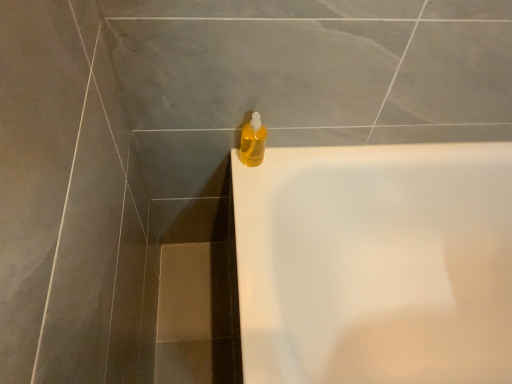
Question: Would you say white glossy bathtub at upper right contains translucent yellow liquid at upper right?

Choices:
 (A) yes
 (B) no

Answer: (B)

Question: Are white glossy bathtub at upper right and translucent yellow liquid at upper right located far from each other?

Choices:
 (A) yes
 (B) no

Answer: (B)

Question: Considering the relative sizes of white glossy bathtub at upper right and translucent yellow liquid at upper right in the image provided, is white glossy bathtub at upper right thinner than translucent yellow liquid at upper right?

Choices:
 (A) no
 (B) yes

Answer: (A)

Question: From a real-world perspective, is white glossy bathtub at upper right on translucent yellow liquid at upper right?

Choices:
 (A) no
 (B) yes

Answer: (A)

Question: Is white glossy bathtub at upper right turned away from translucent yellow liquid at upper right?

Choices:
 (A) yes
 (B) no

Answer: (B)

Question: Considering the relative sizes of white glossy bathtub at upper right and translucent yellow liquid at upper right in the image provided, is white glossy bathtub at upper right taller than translucent yellow liquid at upper right?

Choices:
 (A) yes
 (B) no

Answer: (A)

Question: Is translucent yellow liquid at upper right turned away from white glossy bathtub at upper right?

Choices:
 (A) yes
 (B) no

Answer: (B)

Question: From a real-world perspective, is translucent yellow liquid at upper right located beneath white glossy bathtub at upper right?

Choices:
 (A) no
 (B) yes

Answer: (A)

Question: Is translucent yellow liquid at upper right to the left of white glossy bathtub at upper right from the viewer's perspective?

Choices:
 (A) yes
 (B) no

Answer: (A)

Question: Does translucent yellow liquid at upper right come in front of white glossy bathtub at upper right?

Choices:
 (A) yes
 (B) no

Answer: (B)

Question: From a real-world perspective, is translucent yellow liquid at upper right located higher than white glossy bathtub at upper right?

Choices:
 (A) no
 (B) yes

Answer: (B)

Question: Is translucent yellow liquid at upper right shorter than white glossy bathtub at upper right?

Choices:
 (A) yes
 (B) no

Answer: (A)

Question: From the image's perspective, is white glossy bathtub at upper right positioned above or below translucent yellow liquid at upper right?

Choices:
 (A) below
 (B) above

Answer: (A)